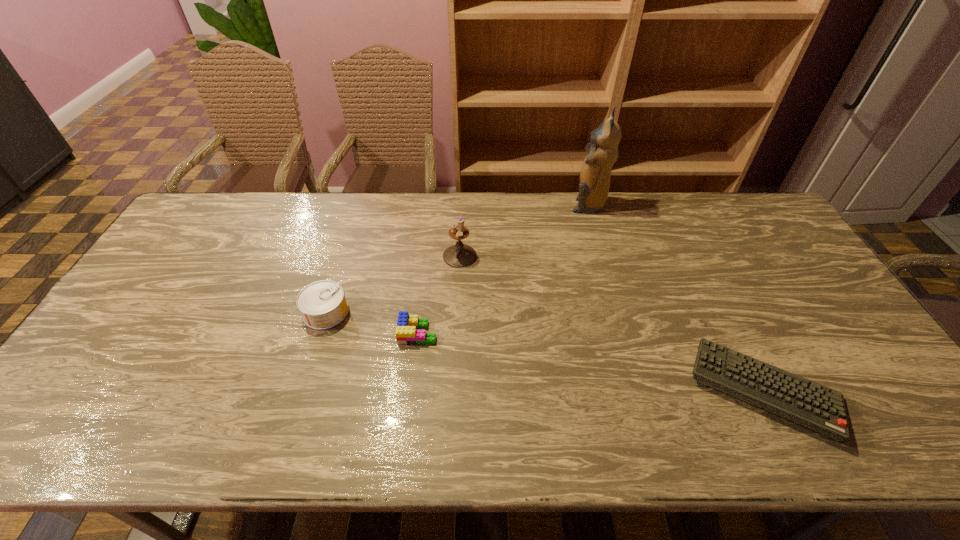
You are a GUI agent. You are given a task and a screenshot of the screen. Output one action in this format:
    pyautogui.click(x=<x>, y=<y>)
    Task: Click on the vacant space located on the face of the tallest object
    This screenshot has height=540, width=960.
    Given the screenshot: What is the action you would take?
    pyautogui.click(x=526, y=205)

This screenshot has width=960, height=540. I want to click on vacant space located 0.220m on the right of the candle holder, so click(x=546, y=256).

Locate an element on the screen. This screenshot has width=960, height=540. free space located 0.300m on the left of the leftmost object is located at coordinates (196, 312).

This screenshot has height=540, width=960. Find the location of `vacant space located 0.220m on the left of the Lego`. vacant space located 0.220m on the left of the Lego is located at coordinates (318, 333).

What are the coordinates of `free spot located 0.280m on the left of the computer keyboard` in the screenshot? It's located at (575, 389).

At what (x,y) coordinates should I click in order to perform the action: click on object positioned at the far edge. Please return your answer as a coordinate pair (x, y). The width and height of the screenshot is (960, 540). Looking at the image, I should click on (594, 178).

Identify the location of object located at the near edge. The image size is (960, 540). (812, 405).

Locate an element on the screen. object situated at the right edge is located at coordinates click(812, 405).

The height and width of the screenshot is (540, 960). In order to click on object that is at the near right corner in this screenshot , I will do point(812,405).

This screenshot has width=960, height=540. I want to click on vacant space at the far edge of the desktop, so click(x=291, y=208).